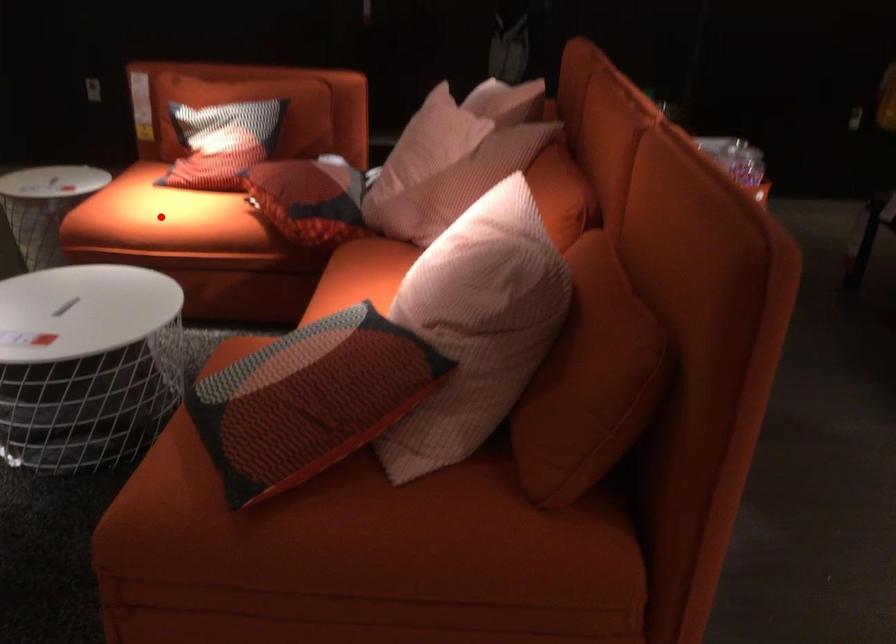
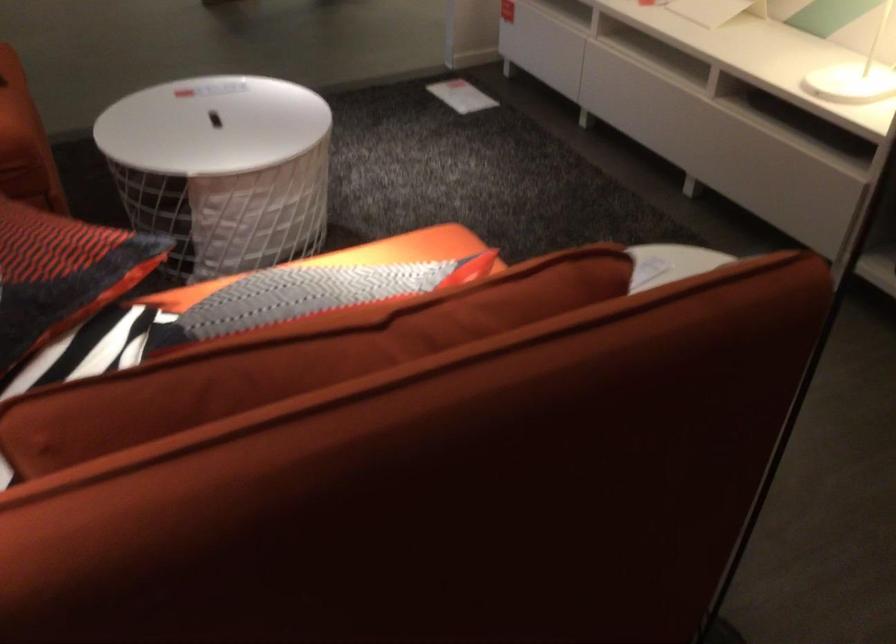
Question: I am providing you with two images of the same scene from different viewpoints. A red point is marked on the first image. Can you still see the location of the red point in image 2?

Choices:
 (A) Yes
 (B) No

Answer: (B)